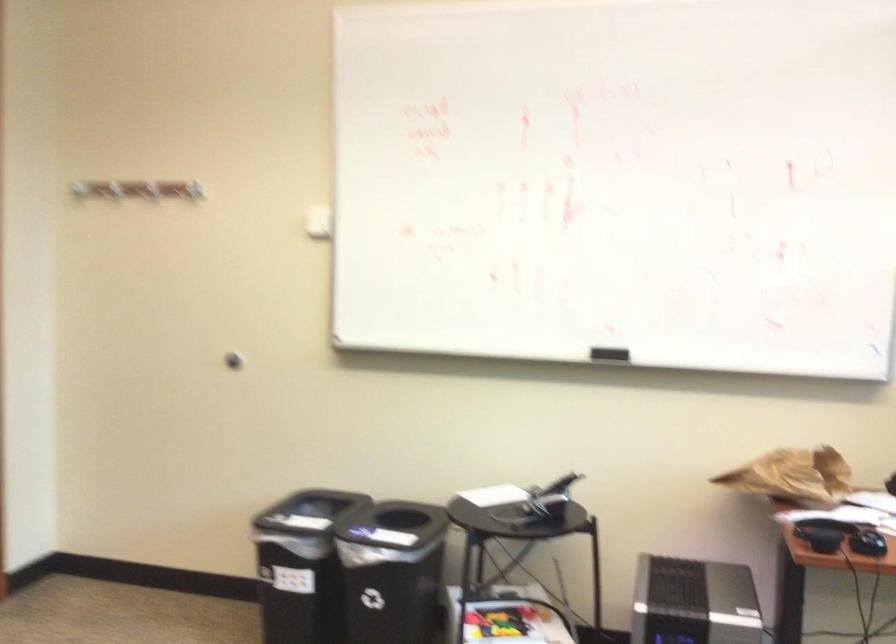
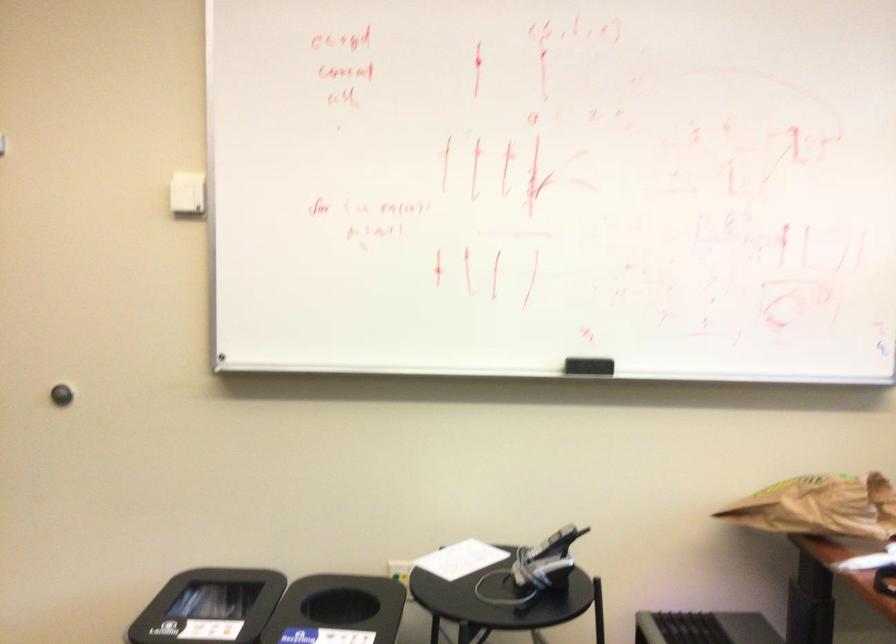
Where in the second image is the point corresponding to (x=562, y=489) from the first image?

(552, 544)